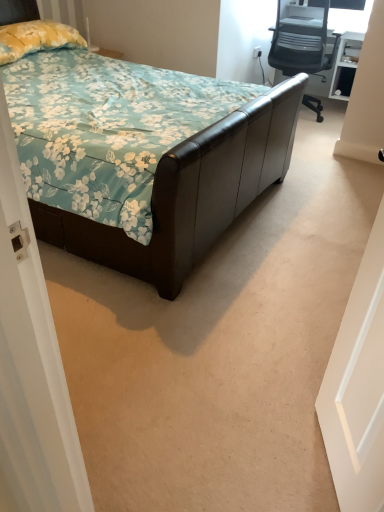
Question: Is white plastic power outlet at upper right oriented away from yellow floral fabric pillow at upper left?

Choices:
 (A) yes
 (B) no

Answer: (B)

Question: Are white plastic power outlet at upper right and yellow floral fabric pillow at upper left making contact?

Choices:
 (A) no
 (B) yes

Answer: (A)

Question: From the image's perspective, is white plastic power outlet at upper right on top of yellow floral fabric pillow at upper left?

Choices:
 (A) no
 (B) yes

Answer: (B)

Question: From a real-world perspective, is white plastic power outlet at upper right under yellow floral fabric pillow at upper left?

Choices:
 (A) yes
 (B) no

Answer: (A)

Question: Is white plastic power outlet at upper right located outside yellow floral fabric pillow at upper left?

Choices:
 (A) no
 (B) yes

Answer: (B)

Question: Considering the positions of point (344, 398) and point (321, 10), is point (344, 398) closer or farther from the camera than point (321, 10)?

Choices:
 (A) farther
 (B) closer

Answer: (B)

Question: Considering the positions of white matte door at right and gray mesh office chair at upper right in the image, is white matte door at right bigger or smaller than gray mesh office chair at upper right?

Choices:
 (A) small
 (B) big

Answer: (A)

Question: Relative to gray mesh office chair at upper right, is white matte door at right in front or behind?

Choices:
 (A) front
 (B) behind

Answer: (A)

Question: From a real-world perspective, is white matte door at right positioned above or below gray mesh office chair at upper right?

Choices:
 (A) below
 (B) above

Answer: (B)

Question: Do you think brown leather bed at center is within yellow floral fabric pillow at upper left, or outside of it?

Choices:
 (A) outside
 (B) inside

Answer: (A)

Question: Is brown leather bed at center bigger or smaller than yellow floral fabric pillow at upper left?

Choices:
 (A) big
 (B) small

Answer: (A)

Question: Considering the positions of brown leather bed at center and yellow floral fabric pillow at upper left in the image, is brown leather bed at center taller or shorter than yellow floral fabric pillow at upper left?

Choices:
 (A) tall
 (B) short

Answer: (A)

Question: Visually, is brown leather bed at center positioned to the left or to the right of yellow floral fabric pillow at upper left?

Choices:
 (A) right
 (B) left

Answer: (A)

Question: Is white matte door at right wider or thinner than white plastic power outlet at upper right?

Choices:
 (A) wide
 (B) thin

Answer: (A)

Question: Considering the relative positions of white matte door at right and white plastic power outlet at upper right in the image provided, is white matte door at right to the left or to the right of white plastic power outlet at upper right?

Choices:
 (A) right
 (B) left

Answer: (B)